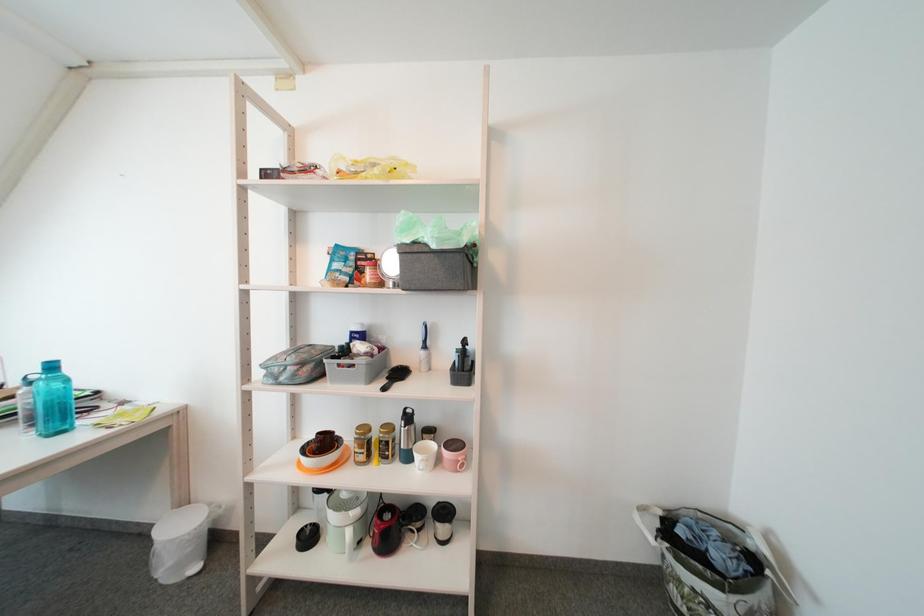
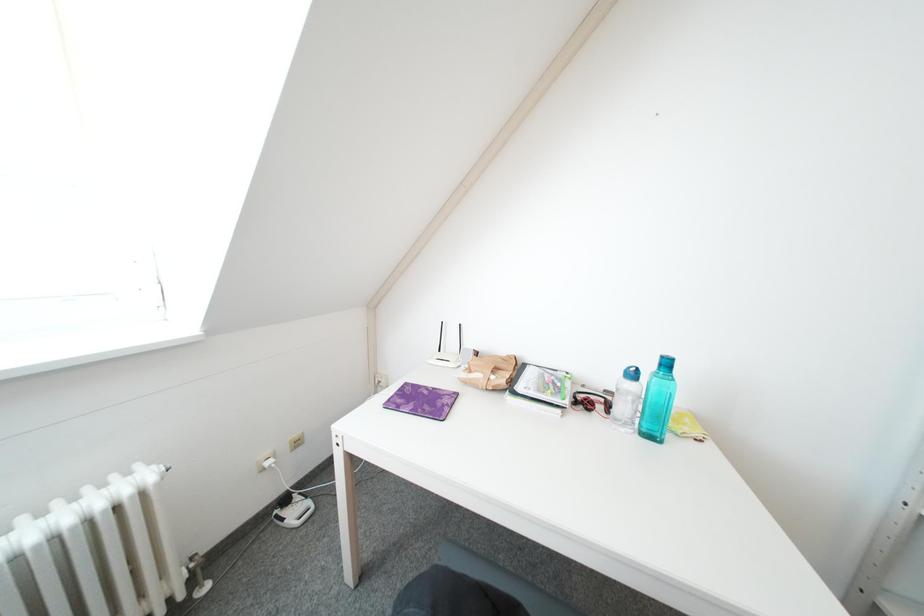
Question: The images are taken continuously from a first-person perspective. In which direction are you moving?

Choices:
 (A) Left
 (B) Right
 (C) Forward
 (D) Backward

Answer: (A)